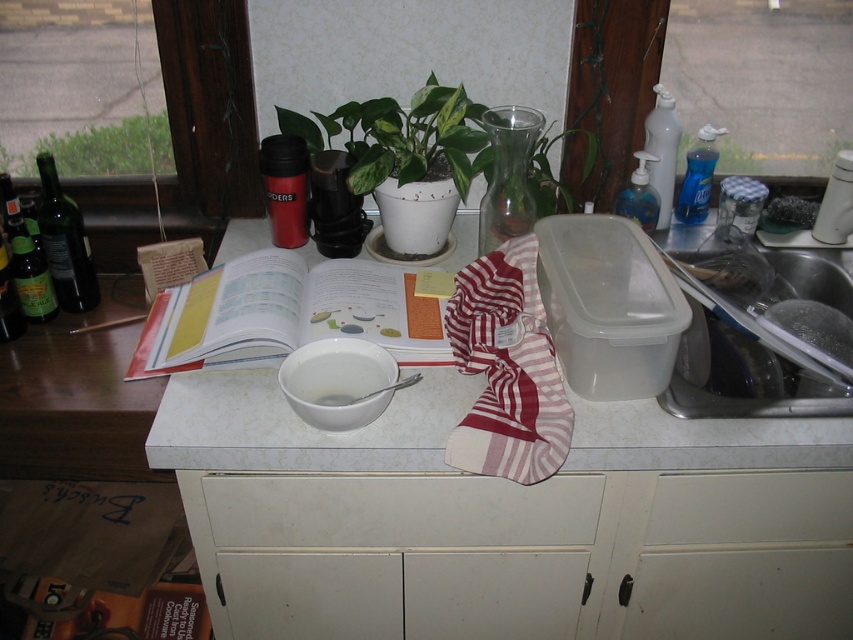
Question: Does green glossy plant at upper center lie in front of white glossy bowl at center?

Choices:
 (A) yes
 (B) no

Answer: (B)

Question: Which point is farther from the camera taking this photo?

Choices:
 (A) (244, 292)
 (B) (39, 147)
 (C) (363, 381)

Answer: (B)

Question: Among these objects, which one is farthest from the camera?

Choices:
 (A) transparent plastic soap dispenser at upper right
 (B) white glossy bowl at center

Answer: (A)

Question: Which object is positioned closest to the clear plastic bottle at upper right?

Choices:
 (A) green leafy plant at upper center
 (B) white plastic pump bottle at upper right

Answer: (B)

Question: Is green glass bottle at left wider than white plastic pump bottle at upper right?

Choices:
 (A) no
 (B) yes

Answer: (B)

Question: Can you confirm if white matte drawer at center is positioned to the right of clear plastic bottle at upper right?

Choices:
 (A) no
 (B) yes

Answer: (A)